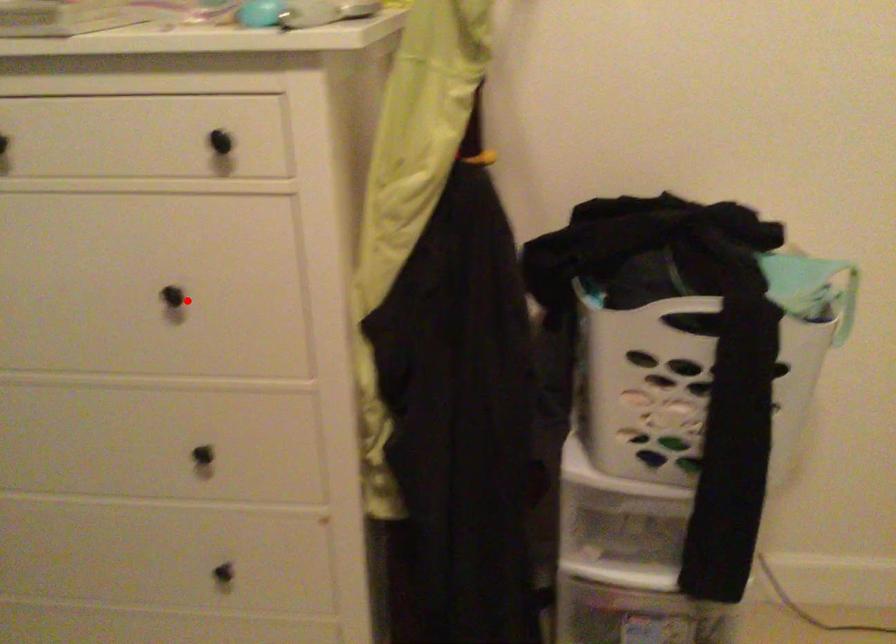
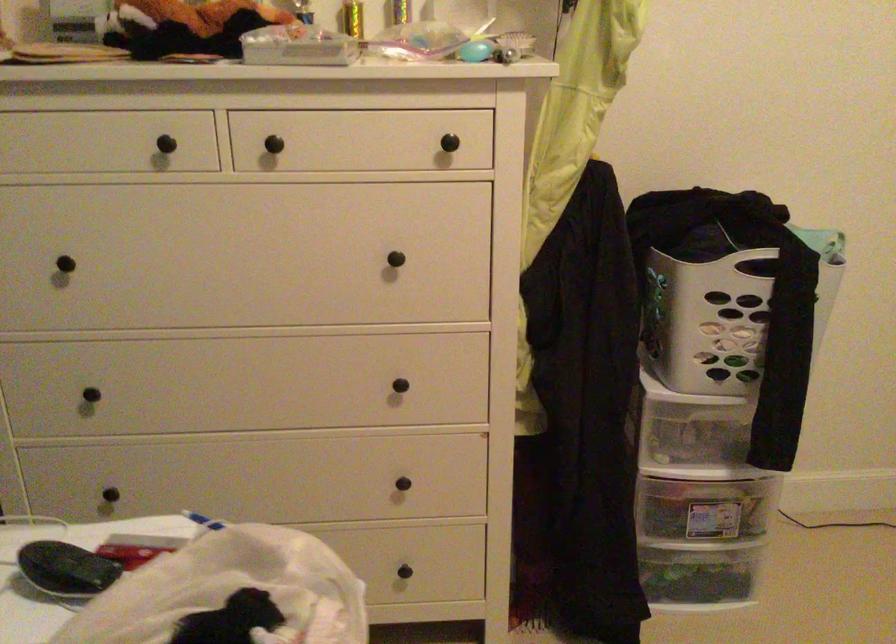
Question: I am providing you with two images of the same scene from different viewpoints. Given a red point in image1, look at the same physical point in image2. Is it:

Choices:
 (A) Closer to the viewpoint
 (B) Farther from the viewpoint

Answer: (B)